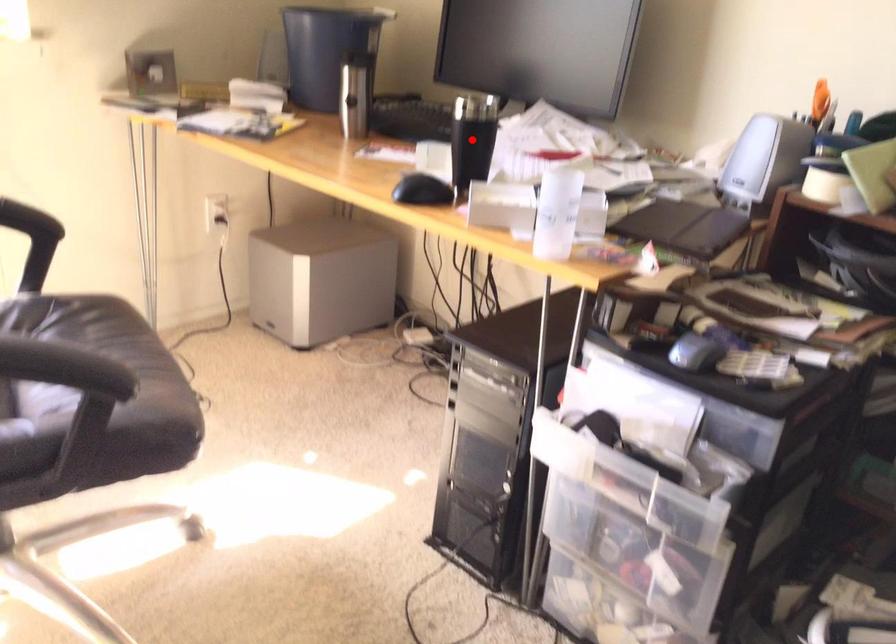
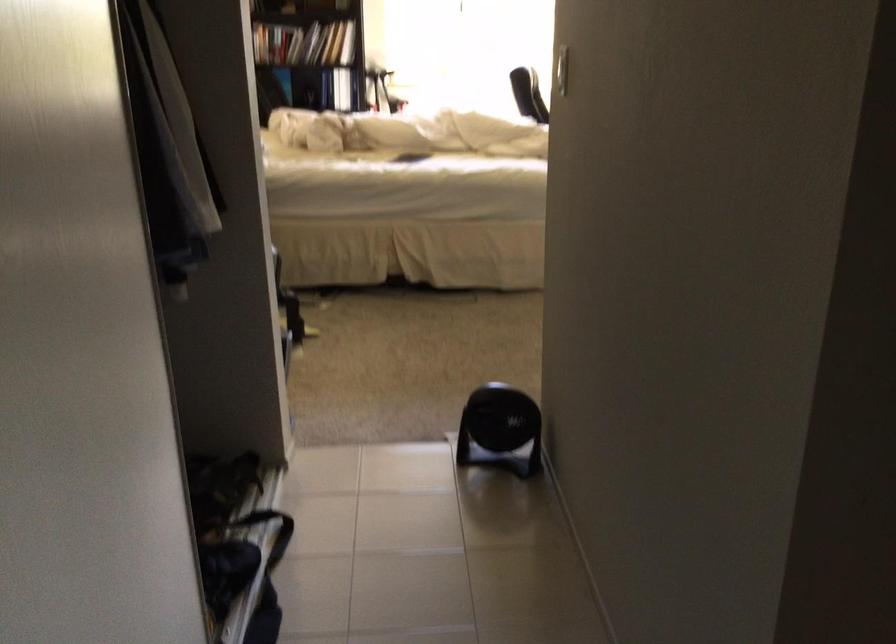
Question: I am providing you with two images of the same scene from different viewpoints. A red point is marked on the first image. Is the red point's position out of view in image 2?

Choices:
 (A) Yes
 (B) No

Answer: (A)